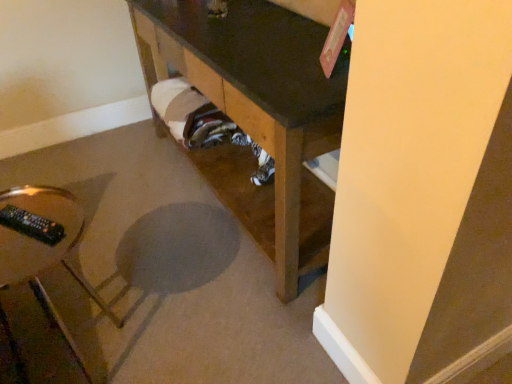
Question: Does brown wood table at lower center, positioned as the 1th furniture in right-to-left order, have a lesser width compared to clear glass remote control at lower left, arranged as the 2th furniture when viewed from the right?

Choices:
 (A) yes
 (B) no

Answer: (B)

Question: Is brown wood table at lower center, positioned as the 1th furniture in right-to-left order, located outside clear glass remote control at lower left, the first furniture when ordered from left to right?

Choices:
 (A) yes
 (B) no

Answer: (A)

Question: From the image's perspective, would you say brown wood table at lower center, positioned as the 1th furniture in right-to-left order, is shown under clear glass remote control at lower left, the first furniture when ordered from left to right?

Choices:
 (A) yes
 (B) no

Answer: (B)

Question: Is brown wood table at lower center, acting as the second furniture starting from the left, to the left of clear glass remote control at lower left, the first furniture when ordered from left to right, from the viewer's perspective?

Choices:
 (A) yes
 (B) no

Answer: (B)

Question: Does brown wood table at lower center, acting as the second furniture starting from the left, have a larger size compared to clear glass remote control at lower left, the first furniture when ordered from left to right?

Choices:
 (A) no
 (B) yes

Answer: (B)

Question: Is brown wood table at lower center, positioned as the 1th furniture in right-to-left order, directly adjacent to clear glass remote control at lower left, arranged as the 2th furniture when viewed from the right?

Choices:
 (A) no
 (B) yes

Answer: (A)

Question: Does clear glass remote control at lower left, arranged as the 2th furniture when viewed from the right, turn towards brown wood table at lower center, acting as the second furniture starting from the left?

Choices:
 (A) no
 (B) yes

Answer: (A)

Question: Considering the relative sizes of clear glass remote control at lower left, arranged as the 2th furniture when viewed from the right, and brown wood table at lower center, positioned as the 1th furniture in right-to-left order, in the image provided, is clear glass remote control at lower left, arranged as the 2th furniture when viewed from the right, bigger than brown wood table at lower center, positioned as the 1th furniture in right-to-left order,?

Choices:
 (A) yes
 (B) no

Answer: (B)

Question: Is clear glass remote control at lower left, the first furniture when ordered from left to right, placed right next to brown wood table at lower center, acting as the second furniture starting from the left?

Choices:
 (A) no
 (B) yes

Answer: (A)

Question: Would you say clear glass remote control at lower left, arranged as the 2th furniture when viewed from the right, contains brown wood table at lower center, positioned as the 1th furniture in right-to-left order?

Choices:
 (A) no
 (B) yes

Answer: (A)

Question: Is clear glass remote control at lower left, the first furniture when ordered from left to right, behind brown wood table at lower center, acting as the second furniture starting from the left?

Choices:
 (A) no
 (B) yes

Answer: (A)

Question: Is clear glass remote control at lower left, the first furniture when ordered from left to right, far away from brown wood table at lower center, positioned as the 1th furniture in right-to-left order?

Choices:
 (A) yes
 (B) no

Answer: (B)

Question: Looking at the image, does brown wood table at lower center, acting as the second furniture starting from the left, seem bigger or smaller compared to clear glass remote control at lower left, the first furniture when ordered from left to right?

Choices:
 (A) big
 (B) small

Answer: (A)